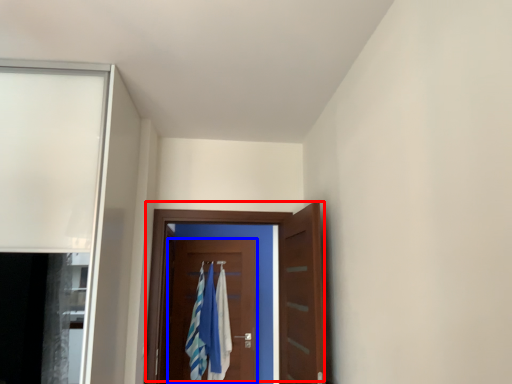
Question: Which object is further to the camera taking this photo, door (highlighted by a red box) or door (highlighted by a blue box)?

Choices:
 (A) door
 (B) door

Answer: (B)